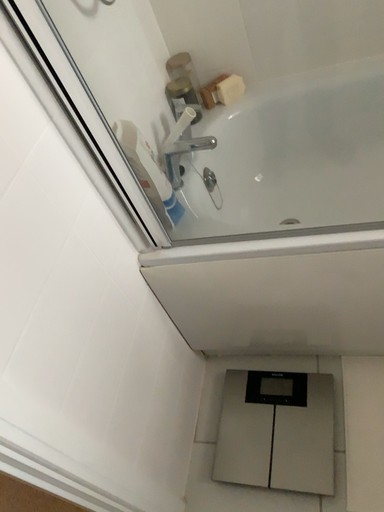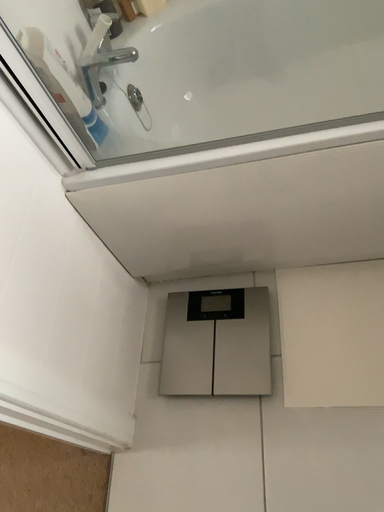
Question: Which way did the camera rotate in the video?

Choices:
 (A) rotated upward
 (B) rotated downward

Answer: (B)